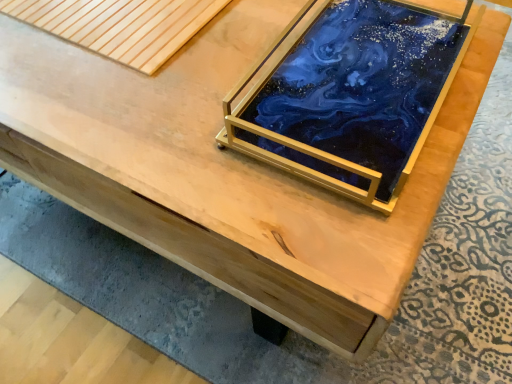
Locate an element on the screen. This screenshot has width=512, height=384. free spot below blue resin tray at center (from a real-world perspective) is located at coordinates click(362, 80).